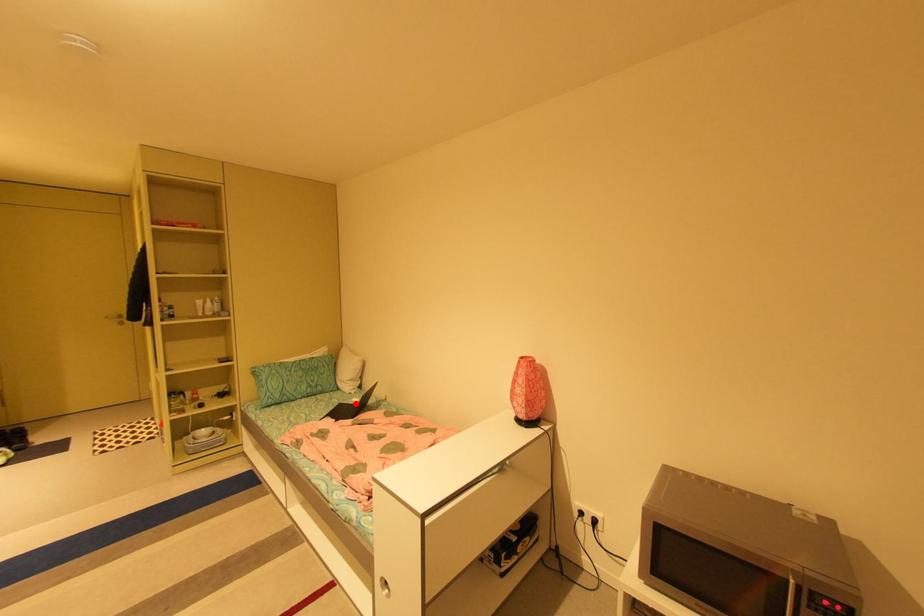
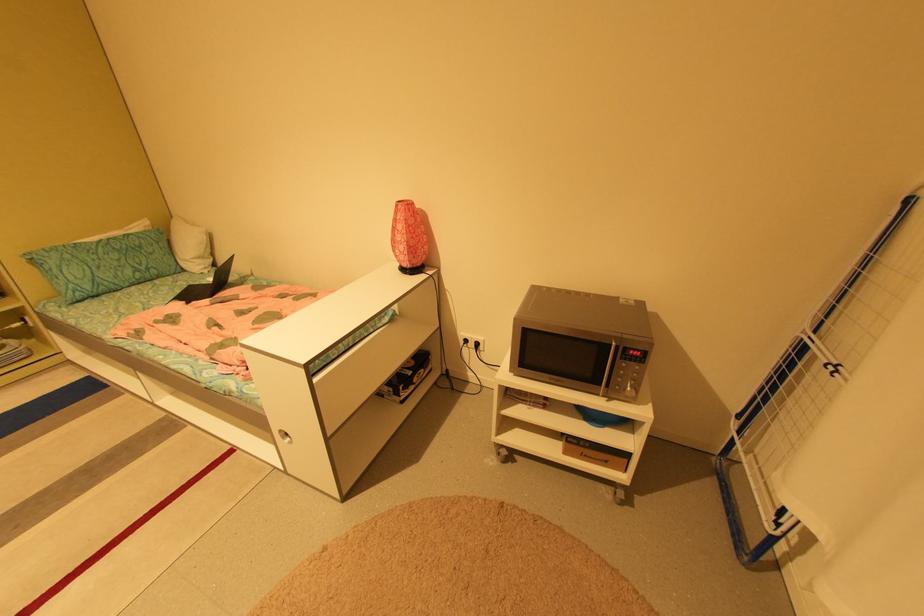
Question: I am providing you with two images of the same scene from different viewpoints. A red point is shown in image1. For the corresponding object point in image2, is it positioned nearer or farther from the camera?

Choices:
 (A) Nearer
 (B) Farther

Answer: (A)